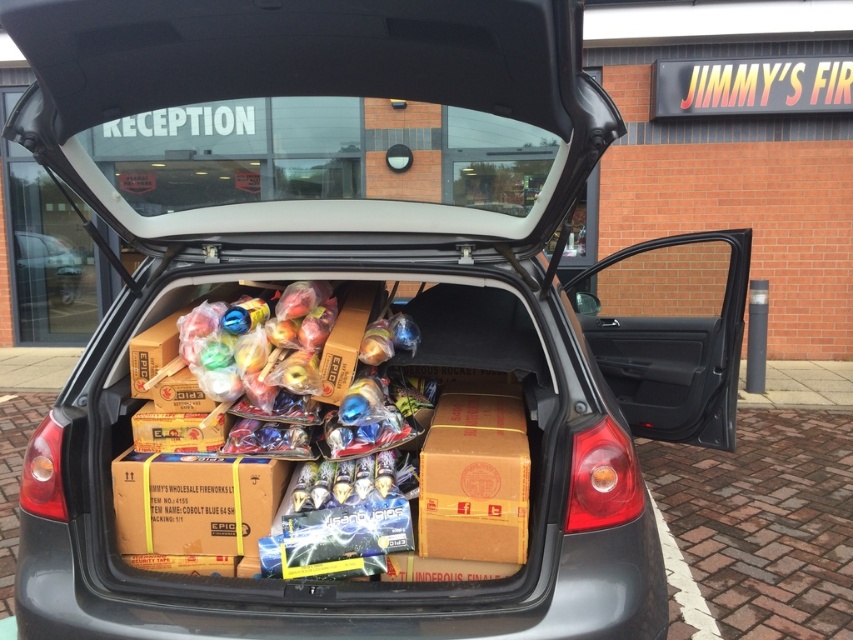
Looking at this image, you are helping to load fireworks into the trunk of a car. The trunk has limited space. You have two boxes to place in the trunk. The brown cardboard box at center and the matte cardboard boxes at center. Which box is narrower and would fit better in tight spaces?

The brown cardboard box at center is narrower than the matte cardboard boxes at center, so it would fit better in tight spaces.

You are standing in front of the car and want to place a new box of fireworks. You have two points to choose from in the trunk. The first point is at coordinate point (x=509, y=461) and the second is at coordinate point (x=74, y=275). Which point is closer to you so that you can easily reach it without leaning too far?

Point (x=509, y=461) is closer to the camera than point (x=74, y=275), so you should place the box at point (x=509, y=461) to easily reach it without leaning too far.